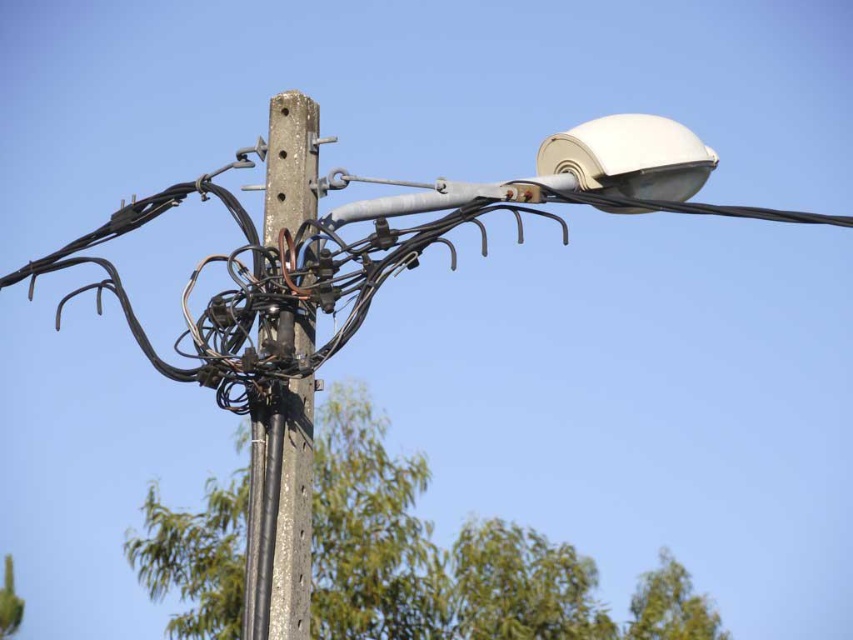
Question: Which of the following is the farthest from the observer?

Choices:
 (A) (305, 436)
 (B) (376, 612)

Answer: (B)

Question: Which of the following is the farthest from the observer?

Choices:
 (A) gray concrete telegraph pole at center
 (B) green leafy tree at center

Answer: (B)

Question: Is green leafy tree at center closer to camera compared to gray concrete telegraph pole at center?

Choices:
 (A) no
 (B) yes

Answer: (A)

Question: Can you confirm if green leafy tree at center is positioned to the left of gray concrete telegraph pole at center?

Choices:
 (A) yes
 (B) no

Answer: (B)

Question: Does green leafy tree at center appear under gray concrete telegraph pole at center?

Choices:
 (A) no
 (B) yes

Answer: (B)